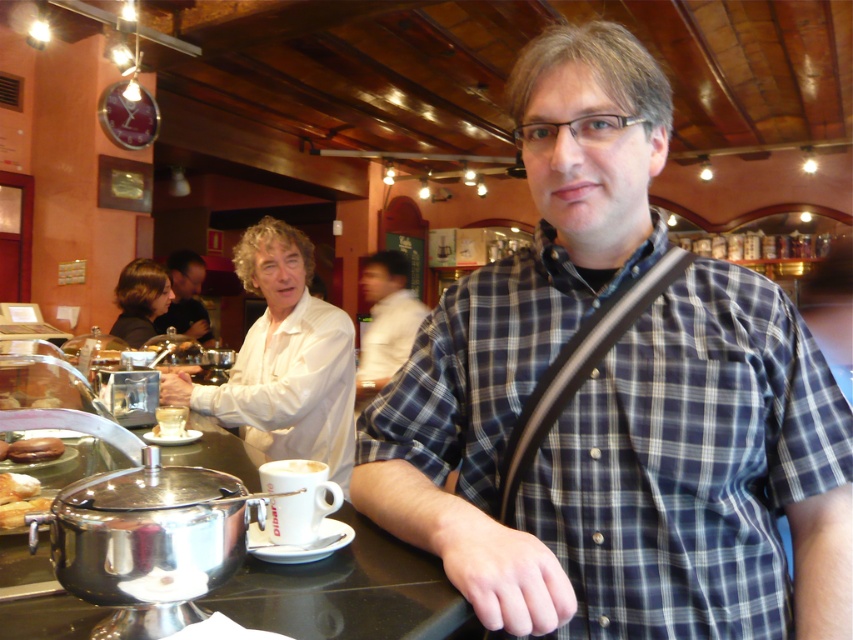
Measure the distance between blue plaid shirt at center and white matte shirt at upper center.

blue plaid shirt at center and white matte shirt at upper center are 1.02 meters apart.

Which is behind, point (816, 380) or point (281, 381)?

Positioned behind is point (281, 381).

Does point (619, 56) lie in front of point (316, 451)?

Yes.

Identify the location of blue plaid shirt at center. (618, 403).

How distant is white bread at center from white matte cup at center?

white bread at center is 13.92 inches away from white matte cup at center.

Between white bread at center and white matte cup at center, which one appears on the right side from the viewer's perspective?

white matte cup at center

Which is in front, point (3, 488) or point (326, 467)?

Point (326, 467)

This screenshot has width=853, height=640. I want to click on white bread at center, so click(16, 486).

Which is below, white matte shirt at center or white bread at center?

white bread at center is lower down.

Is white matte shirt at center to the left of white bread at center from the viewer's perspective?

Incorrect, white matte shirt at center is not on the left side of white bread at center.

Between point (407, 308) and point (19, 476), which one is positioned behind?

Positioned behind is point (407, 308).

Where is `white matte shirt at center`? This screenshot has width=853, height=640. white matte shirt at center is located at coordinates (386, 321).